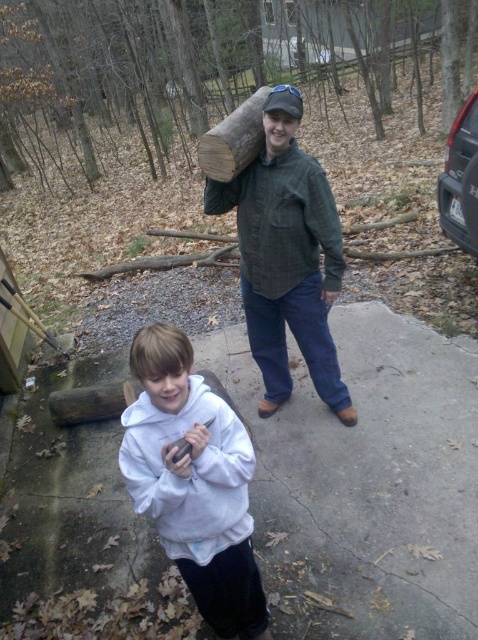
Question: Which object appears closest to the camera in this image?

Choices:
 (A) concrete at center
 (B) green corduroy shirt at center

Answer: (A)

Question: Does concrete at center have a larger size compared to white fleece hoodie at center?

Choices:
 (A) no
 (B) yes

Answer: (B)

Question: Among these objects, which one is nearest to the camera?

Choices:
 (A) white fleece hoodie at center
 (B) green corduroy shirt at center

Answer: (A)

Question: Is white fleece hoodie at center to the right of green corduroy shirt at center from the viewer's perspective?

Choices:
 (A) no
 (B) yes

Answer: (A)

Question: Which object appears closest to the camera in this image?

Choices:
 (A) green corduroy shirt at center
 (B) white fleece hoodie at center

Answer: (B)

Question: Is white fleece hoodie at center above green corduroy shirt at center?

Choices:
 (A) yes
 (B) no

Answer: (B)